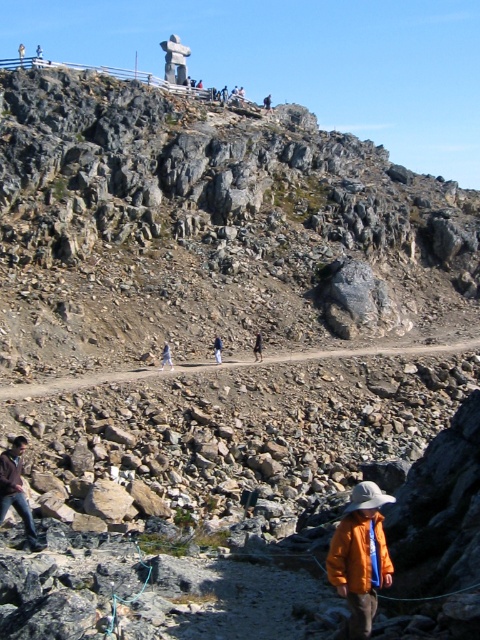
Question: Does orange matte jacket at lower right appear over dark blue jeans at center?

Choices:
 (A) no
 (B) yes

Answer: (A)

Question: Which of the following is the closest to the observer?

Choices:
 (A) (79, 385)
 (B) (259, 346)

Answer: (A)

Question: Is dirt path at center smaller than light blue denim jacket at center?

Choices:
 (A) yes
 (B) no

Answer: (B)

Question: Estimate the real-world distances between objects in this image. Which object is farther from the orange matte jacket at lower right?

Choices:
 (A) blue fabric pants at center
 (B) light blue denim jacket at center

Answer: (B)

Question: Which object appears farthest from the camera in this image?

Choices:
 (A) dirt path at center
 (B) blue fabric pants at center
 (C) light blue denim jacket at center

Answer: (C)

Question: Does orange matte jacket at lower right appear over brown leather jacket at lower left?

Choices:
 (A) yes
 (B) no

Answer: (A)